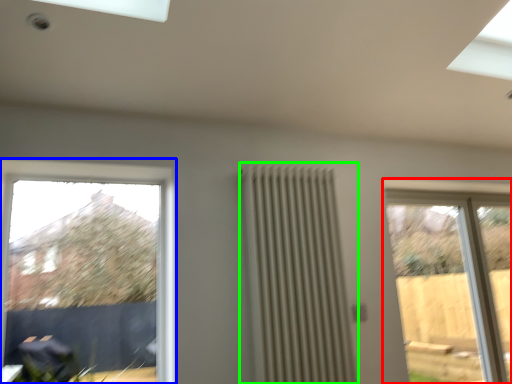
Question: Estimate the real-world distances between objects in this image. Which object is closer to window (highlighted by a red box), window (highlighted by a blue box) or radiator (highlighted by a green box)?

Choices:
 (A) window
 (B) radiator

Answer: (B)